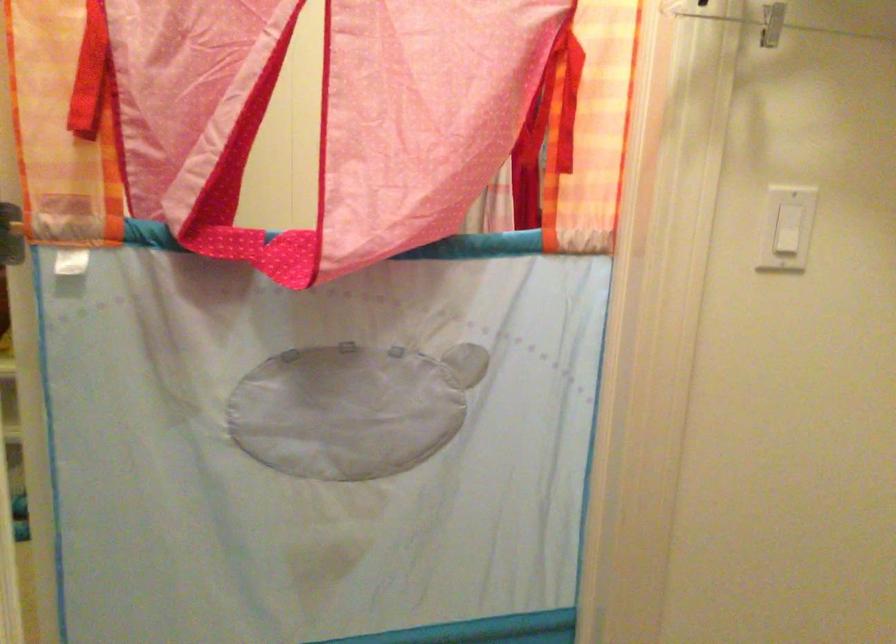
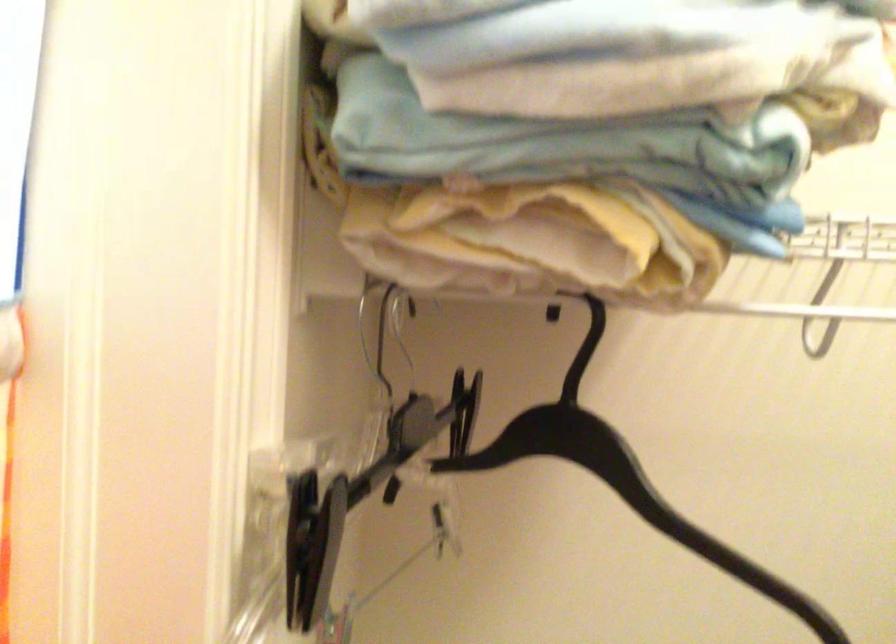
Question: The camera is either moving clockwise (left) or counter-clockwise (right) around the object. The first image is from the beginning of the video and the second image is from the end. Is the camera moving left or right when shooting the video?

Choices:
 (A) Left
 (B) Right

Answer: (A)